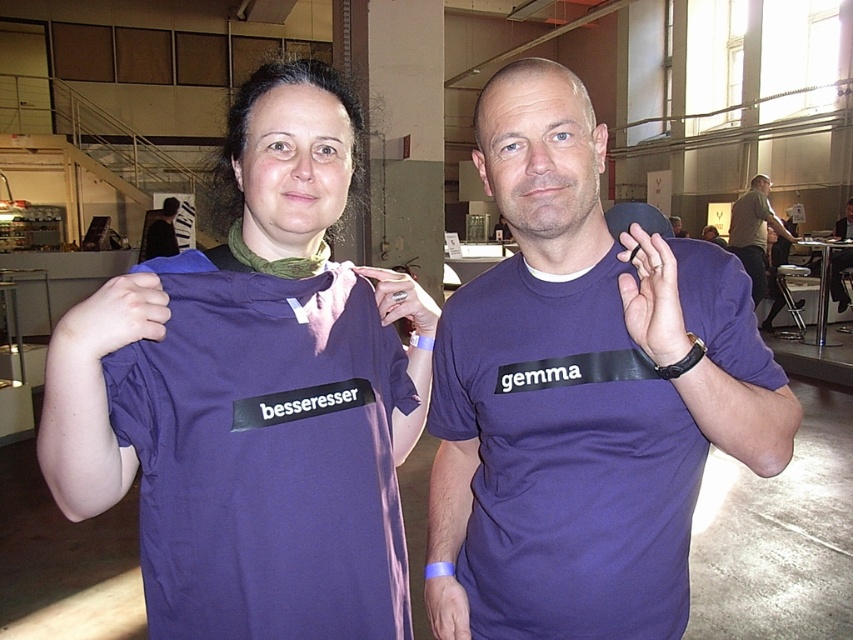
Which is more to the left, purple matte t-shirt at center or matte purple shirt at center?

purple matte t-shirt at center is more to the left.

Is point (778, 429) farther from viewer compared to point (601, 208)?

That is False.

Is point (747, 284) closer to viewer compared to point (508, 253)?

Yes, point (747, 284) is closer to viewer.

Find the location of a particular element. The height and width of the screenshot is (640, 853). purple matte t-shirt at center is located at coordinates pyautogui.click(x=582, y=394).

Is matte brown shirt at upper right further to the viewer compared to matte purple shirt at center?

That is True.

At what (x,y) coordinates should I click in order to perform the action: click on matte brown shirt at upper right. Please return your answer as a coordinate pair (x, y). The image size is (853, 640). Looking at the image, I should click on (753, 230).

Between point (764, 276) and point (503, 244), which one is positioned behind?

Positioned behind is point (503, 244).

You are a GUI agent. You are given a task and a screenshot of the screen. Output one action in this format:
    pyautogui.click(x=<x>, y=<y>)
    Task: Click on the matte brown shirt at upper right
    The width and height of the screenshot is (853, 640).
    Given the screenshot: What is the action you would take?
    pyautogui.click(x=753, y=230)

Who is positioned more to the left, matte purple t-shirt at center or matte purple shirt at center?

From the viewer's perspective, matte purple t-shirt at center appears more on the left side.

Does matte purple t-shirt at center appear on the right side of matte purple shirt at center?

In fact, matte purple t-shirt at center is to the left of matte purple shirt at center.

Identify the location of matte purple t-shirt at center. (247, 438).

Identify the location of matte purple t-shirt at center. (247, 438).